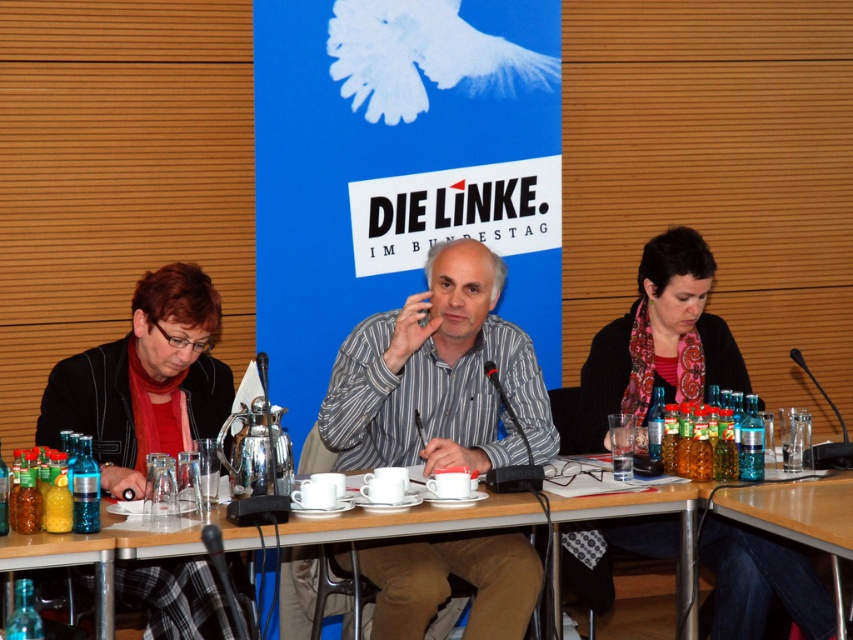
Based on the photo, you are a photographer at the event and need to position yourself to capture both the dark gray sweater at center and the wooden table at lower right in the same frame. Based on their positions, which object should you place closer to the left side of your camera frame?

The dark gray sweater at center should be placed closer to the left side of your camera frame because it is positioned to the left of the wooden table at lower right.

You are attending a press conference and notice two people sitting at the table wearing a striped cotton shirt at center and a dark gray sweater at center. Which clothing item is closer to you?

The striped cotton shirt at center is closer to you because it is in front of the dark gray sweater at center.